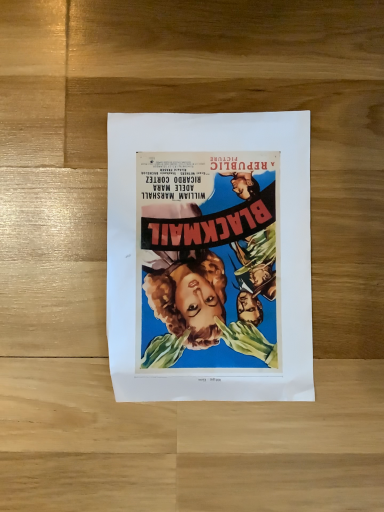
What is the approximate height of matte paper poster at center?

matte paper poster at center is 1.07 inches tall.

In order to face matte paper poster at center, should I rotate leftwards or rightwards?

You should look right and rotate roughly 2.174 degrees.

Describe the element at coordinates (209, 257) in the screenshot. The image size is (384, 512). I see `matte paper poster at center` at that location.

This screenshot has width=384, height=512. What are the coordinates of `matte paper poster at center` in the screenshot? It's located at (209, 257).

This screenshot has width=384, height=512. Find the location of `matte paper poster at center`. matte paper poster at center is located at coordinates (209, 257).